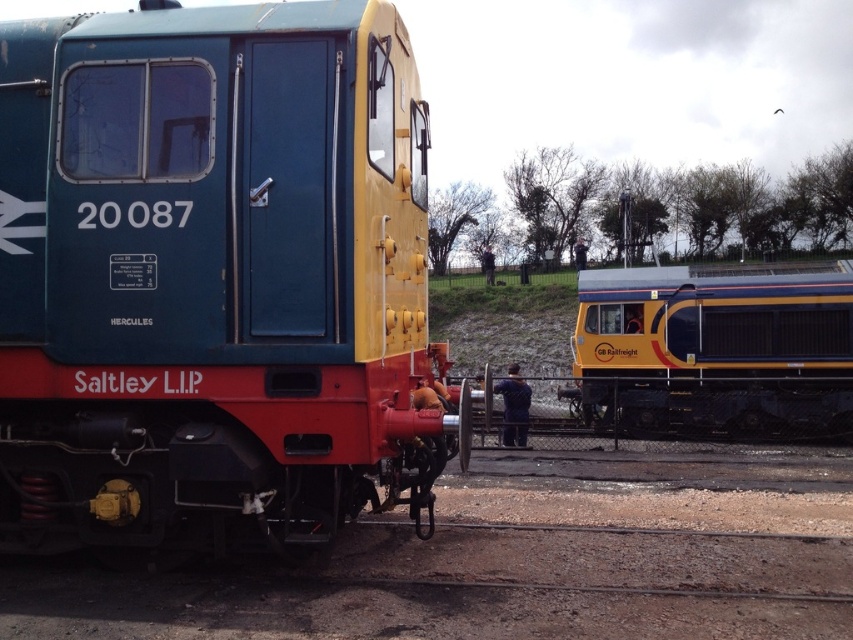
Question: Among these objects, which one is farthest from the camera?

Choices:
 (A) dirt track at lower center
 (B) yellow metallic train at right

Answer: (B)

Question: Which object is closer to the camera taking this photo?

Choices:
 (A) yellow metallic train at right
 (B) dirt track at lower center
 (C) matte blue train at center

Answer: (B)

Question: Which point is farther to the camera?

Choices:
 (A) (268, 339)
 (B) (799, 625)
 (C) (718, 372)

Answer: (C)

Question: Is matte blue train at center to the right of dirt track at lower center from the viewer's perspective?

Choices:
 (A) no
 (B) yes

Answer: (A)

Question: Does dirt track at lower center appear on the right side of yellow metallic train at right?

Choices:
 (A) no
 (B) yes

Answer: (A)

Question: Is dirt track at lower center below yellow metallic train at right?

Choices:
 (A) yes
 (B) no

Answer: (A)